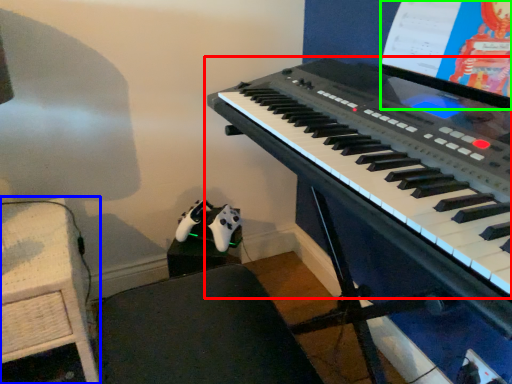
Question: Which is farther away from musical keyboard (highlighted by a red box)? table (highlighted by a blue box) or computer screen (highlighted by a green box)?

Choices:
 (A) table
 (B) computer screen

Answer: (A)